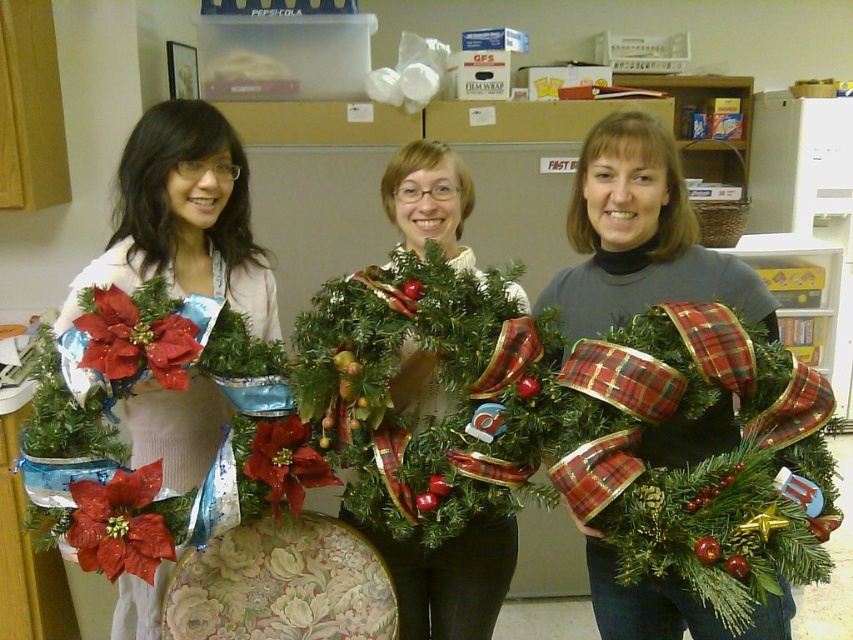
Question: Does shiny red ribbon at center lie behind matte green wreath at center?

Choices:
 (A) yes
 (B) no

Answer: (B)

Question: Can you confirm if shiny red ribbon at center is thinner than matte white sweater at center?

Choices:
 (A) no
 (B) yes

Answer: (A)

Question: Which of the following is the closest to the observer?

Choices:
 (A) (764, 392)
 (B) (107, 570)
 (C) (192, 218)
 (D) (479, 547)

Answer: (B)

Question: Among these points, which one is nearest to the camera?

Choices:
 (A) (158, 566)
 (B) (389, 484)
 (C) (108, 550)
 (D) (711, 280)

Answer: (C)

Question: Which point is closer to the camera?

Choices:
 (A) green matte wreath at center
 (B) matte red poinsettia at lower left

Answer: (B)

Question: Does shiny red ribbon at center appear over matte red poinsettia at lower left?

Choices:
 (A) no
 (B) yes

Answer: (B)